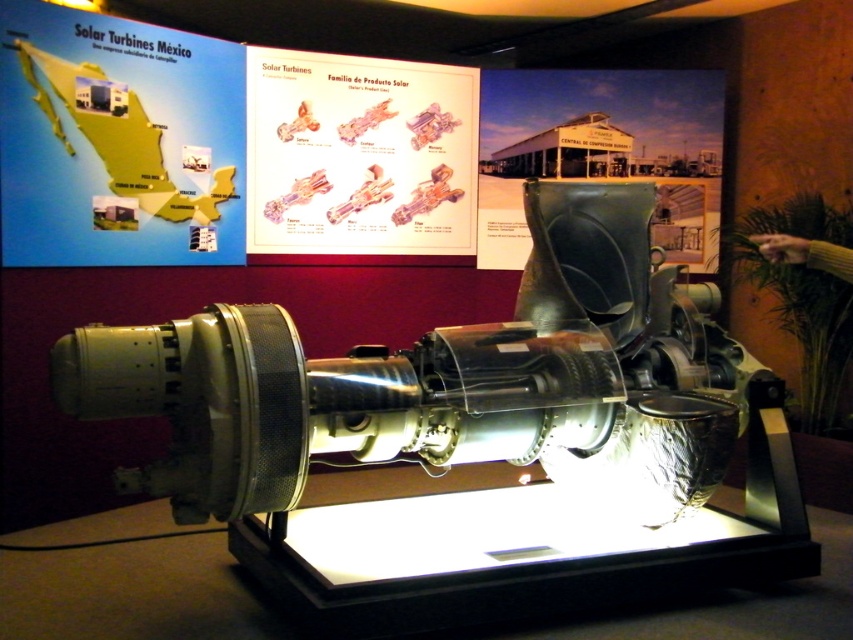
Question: Among these points, which one is nearest to the camera?

Choices:
 (A) (606, 81)
 (B) (413, 122)
 (C) (103, 253)

Answer: (C)

Question: Which object is the farthest from the blue map at upper left?

Choices:
 (A) green matte sign at upper center
 (B) matte metallic engine at center

Answer: (A)

Question: In this image, where is blue map at upper left located relative to matte metallic engine at center?

Choices:
 (A) left
 (B) right

Answer: (A)

Question: Is blue map at upper left above matte metallic engine at center?

Choices:
 (A) yes
 (B) no

Answer: (B)

Question: Does blue map at upper left have a greater width compared to green matte sign at upper center?

Choices:
 (A) yes
 (B) no

Answer: (B)

Question: Which of the following is the closest to the observer?

Choices:
 (A) matte metallic engine at center
 (B) green matte sign at upper center

Answer: (A)